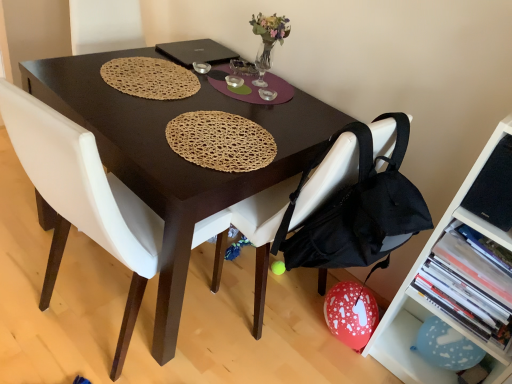
This screenshot has width=512, height=384. Identify the location of vacant space in between translucent glass vase at upper center and metallic silver bowl at center. (224, 72).